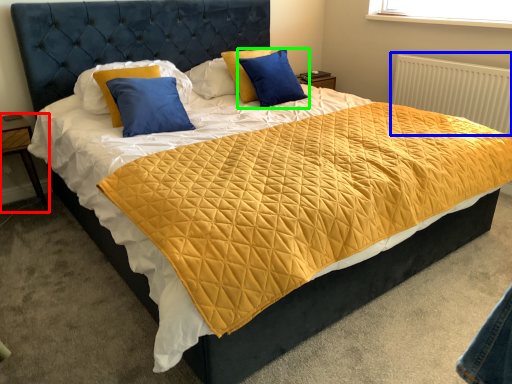
Question: Which object is positioned closest to nightstand (highlighted by a red box)? Select from radiator (highlighted by a blue box) and pillow (highlighted by a green box).

Choices:
 (A) radiator
 (B) pillow

Answer: (B)